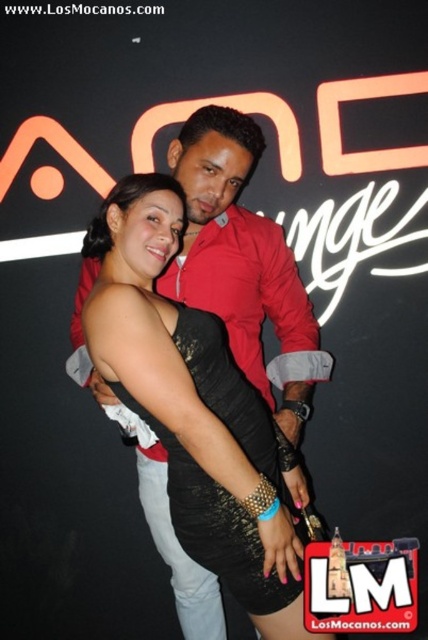
Question: Does black sequined dress at center have a lesser width compared to black lace dress at center?

Choices:
 (A) yes
 (B) no

Answer: (B)

Question: Is black sequined dress at center thinner than black lace dress at center?

Choices:
 (A) yes
 (B) no

Answer: (B)

Question: Among these points, which one is nearest to the camera?

Choices:
 (A) (199, 472)
 (B) (89, 378)

Answer: (A)

Question: Can you confirm if black sequined dress at center is wider than black lace dress at center?

Choices:
 (A) yes
 (B) no

Answer: (A)

Question: Which of the following is the farthest from the observer?

Choices:
 (A) (151, 416)
 (B) (288, 257)

Answer: (B)